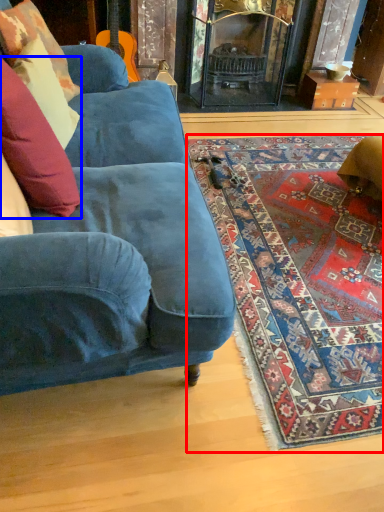
Question: Among these objects, which one is farthest to the camera, mat (highlighted by a red box) or pillow (highlighted by a blue box)?

Choices:
 (A) mat
 (B) pillow

Answer: (A)